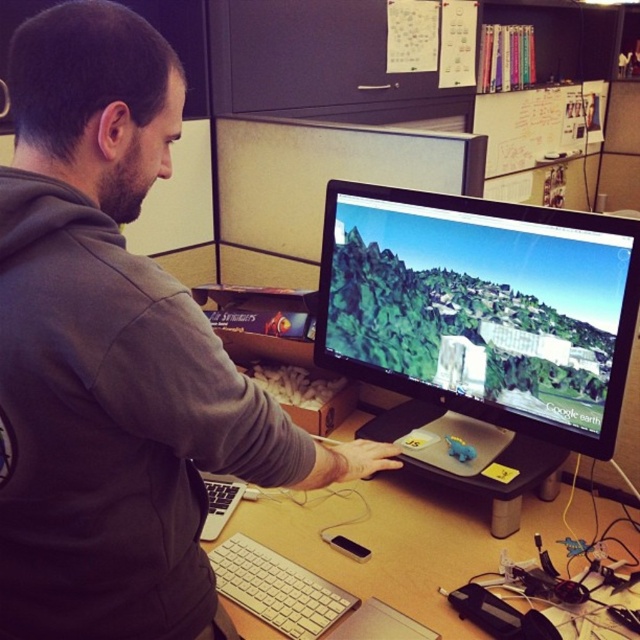
Which of these two, gray matte hoodie at center or wooden desk at center, stands taller?

gray matte hoodie at center is taller.

Is gray matte hoodie at center thinner than wooden desk at center?

Yes, gray matte hoodie at center is thinner than wooden desk at center.

Is point (20, 440) positioned behind point (324, 488)?

No, (20, 440) is in front of (324, 488).

In order to click on gray matte hoodie at center in this screenshot , I will do `click(115, 355)`.

Which is in front, point (88, 170) or point (276, 577)?

Point (88, 170)

Can you confirm if gray matte hoodie at center is positioned to the left of silver metallic keyboard at lower center?

Yes, gray matte hoodie at center is to the left of silver metallic keyboard at lower center.

At what (x,y) coordinates should I click in order to perform the action: click on gray matte hoodie at center. Please return your answer as a coordinate pair (x, y). The height and width of the screenshot is (640, 640). Looking at the image, I should click on (115, 355).

Which is below, gray matte hoodie at center or matte black monitor at center?

Positioned lower is gray matte hoodie at center.

Is gray matte hoodie at center smaller than matte black monitor at center?

Actually, gray matte hoodie at center might be larger than matte black monitor at center.

The height and width of the screenshot is (640, 640). In order to click on gray matte hoodie at center in this screenshot , I will do `click(115, 355)`.

Find the location of `gray matte hoodie at center`. gray matte hoodie at center is located at coordinates (115, 355).